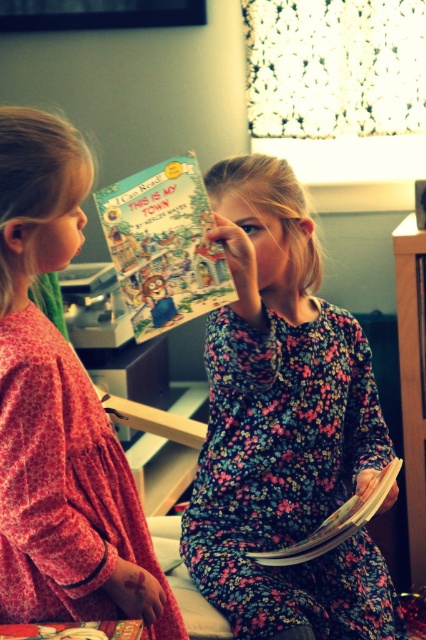
You are a photographer trying to capture the best angle of the two girls reading. You notice two points marked in the scene. Which point is closer to the camera, point (112, 234) or point (138, 621)?

Point (112, 234) is closer to the camera than point (138, 621).

You are a parent trying to choose a book for your child. You see the wooden at right and the hardcover book at center. Which item is more suitable for a child to hold comfortably?

The hardcover book at center is more suitable for a child to hold comfortably because the wooden at right is much taller, making it potentially harder for a child to handle.

You are a book lover who wants to place both the wooden at right and the hardcover book at center on a shelf. Which object should you place first to ensure they both fit side by side?

The wooden at right is thinner than the hardcover book at center, so you should place the hardcover book at center first to make sure there is enough space for the thinner wooden at right next to it.